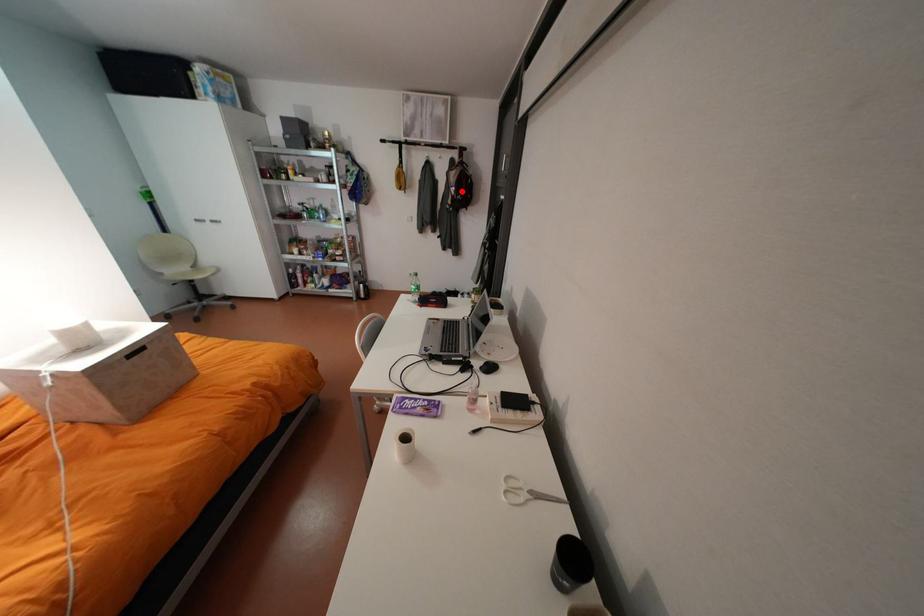
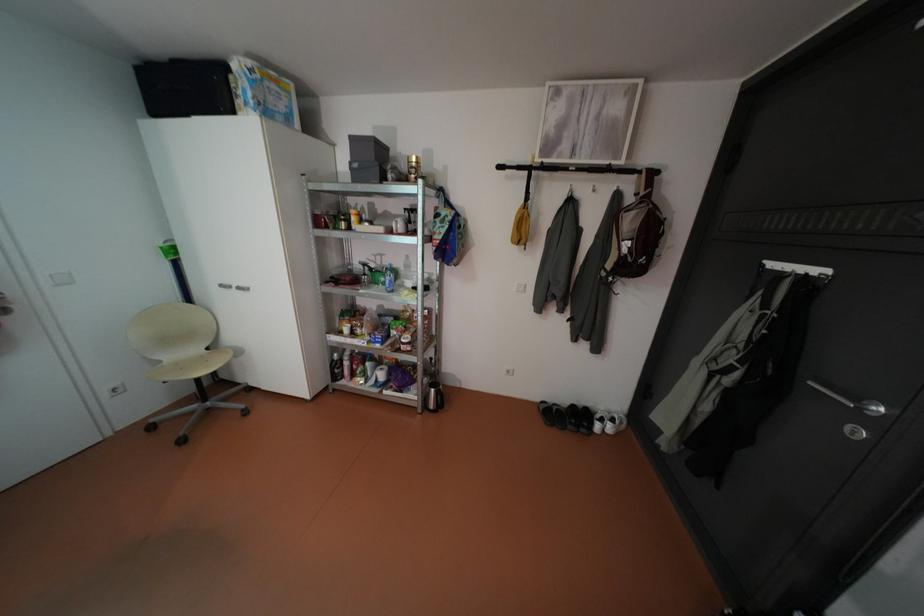
Locate, in the second image, the point that corresponds to the highlighted location in the first image.

(634, 249)